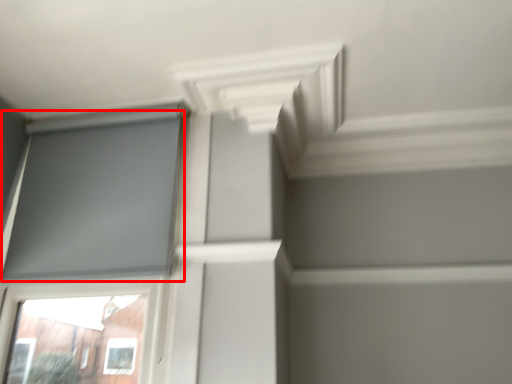
Question: From the image, what is the correct spatial relationship of window screen (annotated by the red box) in relation to exhaust hood?

Choices:
 (A) right
 (B) left

Answer: (B)